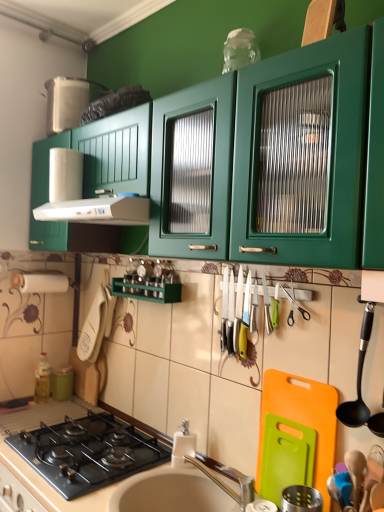
Describe the element at coordinates (88, 452) in the screenshot. I see `black glass gas stove at lower left` at that location.

Describe the element at coordinates (179, 490) in the screenshot. This screenshot has height=512, width=384. I see `white glossy sink at lower center` at that location.

In order to face white glossy sink at lower center, should I rotate leftwards or rightwards?

Turn left by 1.736 degrees to look at white glossy sink at lower center.

You are a GUI agent. You are given a task and a screenshot of the screen. Output one action in this format:
    pyautogui.click(x=<x>, y=<y>)
    Task: Click on the wooden spoon at lower right, marked as the 2th utensil in a top-to-bottom arrangement
    The width and height of the screenshot is (384, 512).
    Given the screenshot: What is the action you would take?
    (x=355, y=473)

Image resolution: width=384 pixels, height=512 pixels. Describe the element at coordinates (97, 211) in the screenshot. I see `white plastic exhaust hood at upper left` at that location.

Find the location of a particular element. The width and height of the screenshot is (384, 512). black plastic spoon at right, which ranks as the second utensil in bottom-to-top order is located at coordinates tap(358, 376).

Describe the element at coordinates (358, 376) in the screenshot. This screenshot has height=512, width=384. I see `black plastic spoon at right, which appears as the first utensil when viewed from the top` at that location.

Describe the element at coordinates (358, 477) in the screenshot. I see `blue rubber spatula at lower right, the 1th appliance when ordered from right to left` at that location.

The height and width of the screenshot is (512, 384). What do you see at coordinates (310, 155) in the screenshot? I see `green matte cabinet at upper center` at bounding box center [310, 155].

The height and width of the screenshot is (512, 384). In order to click on green matte canister at lower left, which appears as the third appliance when viewed from the right in this screenshot , I will do `click(61, 382)`.

Would you say green matte canister at lower left, the 3th appliance when ordered from front to back, contains green plastic cutting board at lower right, which is counted as the 2th appliance, starting from the front?

No, green matte canister at lower left, the 3th appliance when ordered from front to back, does not contain green plastic cutting board at lower right, which is counted as the 2th appliance, starting from the front.

Consider the image. Can you confirm if green matte canister at lower left, which appears as the third appliance when viewed from the right, is taller than green plastic cutting board at lower right, the 2th appliance positioned from the back?

A: Incorrect, the height of green matte canister at lower left, which appears as the third appliance when viewed from the right, is not larger of that of green plastic cutting board at lower right, the 2th appliance positioned from the back.

Considering the positions of objects green matte canister at lower left, which appears as the third appliance when viewed from the right, and green plastic cutting board at lower right, acting as the second appliance starting from the right, in the image provided, who is more to the left, green matte canister at lower left, which appears as the third appliance when viewed from the right, or green plastic cutting board at lower right, acting as the second appliance starting from the right,?

From the viewer's perspective, green matte canister at lower left, which appears as the third appliance when viewed from the right, appears more on the left side.

Does green matte canister at lower left, which appears as the third appliance when viewed from the right, have a smaller size compared to green plastic cutting board at lower right, the 2th appliance positioned from the back?

Correct, green matte canister at lower left, which appears as the third appliance when viewed from the right, occupies less space than green plastic cutting board at lower right, the 2th appliance positioned from the back.

From a real-world perspective, does silver metallic faucet at sink center stand above wooden spoon at lower right, the first utensil from the bottom?

No, from a real-world perspective, silver metallic faucet at sink center is not over wooden spoon at lower right, the first utensil from the bottom

Based on the photo, from the image's perspective, is silver metallic faucet at sink center located above or below wooden spoon at lower right, marked as the 2th utensil in a top-to-bottom arrangement?

Based on their image positions, silver metallic faucet at sink center is located beneath wooden spoon at lower right, marked as the 2th utensil in a top-to-bottom arrangement.

Can you confirm if silver metallic faucet at sink center is smaller than wooden spoon at lower right, marked as the 2th utensil in a top-to-bottom arrangement?

No, silver metallic faucet at sink center is not smaller than wooden spoon at lower right, marked as the 2th utensil in a top-to-bottom arrangement.

Are silver metallic faucet at sink center and white glossy sink at lower center far apart?

No, there isn't a large distance between silver metallic faucet at sink center and white glossy sink at lower center.

Considering the sizes of silver metallic faucet at sink center and white glossy sink at lower center in the image, is silver metallic faucet at sink center taller or shorter than white glossy sink at lower center?

silver metallic faucet at sink center is taller than white glossy sink at lower center.

Is white glossy sink at lower center located within silver metallic faucet at sink center?

No, silver metallic faucet at sink center does not contain white glossy sink at lower center.

From the image's perspective, is silver metallic faucet at sink center above white glossy sink at lower center?

Correct, silver metallic faucet at sink center appears higher than white glossy sink at lower center in the image.

Between green matte canister at lower left, the 3th appliance when ordered from front to back, and white plastic exhaust hood at upper left, which one appears on the right side from the viewer's perspective?

white plastic exhaust hood at upper left is more to the right.

From the image's perspective, is green matte canister at lower left, which appears as the 1th appliance when viewed from the left, above or below white plastic exhaust hood at upper left?

green matte canister at lower left, which appears as the 1th appliance when viewed from the left, is situated lower than white plastic exhaust hood at upper left in the image.

Is green matte canister at lower left, the 3th appliance when ordered from front to back, beside white plastic exhaust hood at upper left?

They are not placed beside each other.

Can we say green matte canister at lower left, which is the first appliance in back-to-front order, lies outside white plastic exhaust hood at upper left?

green matte canister at lower left, which is the first appliance in back-to-front order, lies outside white plastic exhaust hood at upper left's area.

How distant is black glass gas stove at lower left from green plastic cutting board at lower right, which is counted as the 2th appliance, starting from the front?

The distance of black glass gas stove at lower left from green plastic cutting board at lower right, which is counted as the 2th appliance, starting from the front, is 24.31 inches.

Is black glass gas stove at lower left smaller than green plastic cutting board at lower right, the 2th appliance positioned from the back?

Incorrect, black glass gas stove at lower left is not smaller in size than green plastic cutting board at lower right, the 2th appliance positioned from the back.

Does black glass gas stove at lower left touch green plastic cutting board at lower right, the 2th appliance from the left?

There is a gap between black glass gas stove at lower left and green plastic cutting board at lower right, the 2th appliance from the left.

Consider the image. From the image's perspective, which one is positioned lower, black glass gas stove at lower left or green plastic cutting board at lower right, the 2th appliance positioned from the back?

From the image's view, black glass gas stove at lower left is below.

How many degrees apart are the facing directions of white glossy sink at lower center and green matte canister at lower left, which appears as the third appliance when viewed from the right?

They differ by 88.3 degrees in their facing directions.

Is the depth of white glossy sink at lower center greater than that of green matte canister at lower left, which is the first appliance in back-to-front order?

No, white glossy sink at lower center is in front of green matte canister at lower left, which is the first appliance in back-to-front order.

Between point (201, 481) and point (59, 377), which one is positioned behind?

Point (59, 377)

Which is behind, point (14, 408) or point (52, 395)?

The point (52, 395) is behind.

Is beige matte countertop at lower center wider or thinner than green matte canister at lower left, which is the first appliance in back-to-front order?

Considering their sizes, beige matte countertop at lower center looks broader than green matte canister at lower left, which is the first appliance in back-to-front order.

Is beige matte countertop at lower center in front of green matte canister at lower left, the 3th appliance when ordered from front to back?

Yes, beige matte countertop at lower center is closer to the camera.

The image size is (384, 512). I want to click on countertop that is on the right side of green matte canister at lower left, the 3th appliance when ordered from front to back, so click(x=33, y=467).

The width and height of the screenshot is (384, 512). I want to click on appliance below the green plastic cutting board at lower right, the 2th appliance positioned from the back (from a real-world perspective), so click(61, 382).

The image size is (384, 512). I want to click on the 1st utensil counting from the right side of the silver metallic faucet at sink center, so click(x=355, y=473).

When comparing their distances from green matte canister at lower left, the 3th appliance when ordered from front to back, does black plastic spoon at right, which ranks as the second utensil in bottom-to-top order, or beige matte countertop at lower center seem further?

Among the two, black plastic spoon at right, which ranks as the second utensil in bottom-to-top order, is located further to green matte canister at lower left, the 3th appliance when ordered from front to back.

When comparing their distances from green matte canister at lower left, the 3th appliance when ordered from front to back, does silver metallic faucet at sink center or wooden spoon at lower right, the first utensil from the bottom, seem further?

Among the two, wooden spoon at lower right, the first utensil from the bottom, is located further to green matte canister at lower left, the 3th appliance when ordered from front to back.

Looking at the image, which one is located further to wooden spoon at lower right, marked as the 2th utensil in a top-to-bottom arrangement, black glass gas stove at lower left or beige matte countertop at lower center?

Based on the image, beige matte countertop at lower center appears to be further to wooden spoon at lower right, marked as the 2th utensil in a top-to-bottom arrangement.

Which object lies nearer to the anchor point wooden spoon at lower right, the first utensil from the bottom, black plastic spoon at right, which ranks as the second utensil in bottom-to-top order, or black glass gas stove at lower left?

Based on the image, black plastic spoon at right, which ranks as the second utensil in bottom-to-top order, appears to be nearer to wooden spoon at lower right, the first utensil from the bottom.

Looking at the image, which one is located further to white glossy sink at lower center, black glass gas stove at lower left or green matte canister at lower left, which appears as the third appliance when viewed from the right?

green matte canister at lower left, which appears as the third appliance when viewed from the right.

From the image, which object appears to be nearer to green plastic cutting board at lower right, which is counted as the 2th appliance, starting from the front, wooden spoon at lower right, marked as the 2th utensil in a top-to-bottom arrangement, or white plastic exhaust hood at upper left?

wooden spoon at lower right, marked as the 2th utensil in a top-to-bottom arrangement, is positioned closer to the anchor green plastic cutting board at lower right, which is counted as the 2th appliance, starting from the front.

Which object lies further to the anchor point white glossy sink at lower center, beige matte countertop at lower center or wooden spoon at lower right, marked as the 2th utensil in a top-to-bottom arrangement?

Based on the image, wooden spoon at lower right, marked as the 2th utensil in a top-to-bottom arrangement, appears to be further to white glossy sink at lower center.

Looking at the image, which one is located further to white plastic exhaust hood at upper left, silver metallic faucet at sink center or black plastic spoon at right, which appears as the first utensil when viewed from the top?

Based on the image, black plastic spoon at right, which appears as the first utensil when viewed from the top, appears to be further to white plastic exhaust hood at upper left.

At what (x,y) coordinates should I click in order to perform the action: click on appliance between wooden spoon at lower right, marked as the 2th utensil in a top-to-bottom arrangement, and green plastic cutting board at lower right, which is counted as the 2th appliance, starting from the front, along the z-axis. Please return your answer as a coordinate pair (x, y). This screenshot has width=384, height=512. Looking at the image, I should click on (358, 477).

You are a GUI agent. You are given a task and a screenshot of the screen. Output one action in this format:
    pyautogui.click(x=<x>, y=<y>)
    Task: Click on the utensil between green matte cabinet at upper center and blue rubber spatula at lower right, marked as the third appliance in a back-to-front arrangement, in the vertical direction
    
    Given the screenshot: What is the action you would take?
    pyautogui.click(x=358, y=376)

Where is `exhaust hood between green plastic cutting board at lower right, the 2th appliance positioned from the back, and green matte canister at lower left, which appears as the third appliance when viewed from the right, in the front-back direction`? exhaust hood between green plastic cutting board at lower right, the 2th appliance positioned from the back, and green matte canister at lower left, which appears as the third appliance when viewed from the right, in the front-back direction is located at coordinates (97, 211).

The width and height of the screenshot is (384, 512). What are the coordinates of `gas stove between green matte cabinet at upper center and beige matte countertop at lower center from top to bottom` in the screenshot? It's located at (88, 452).